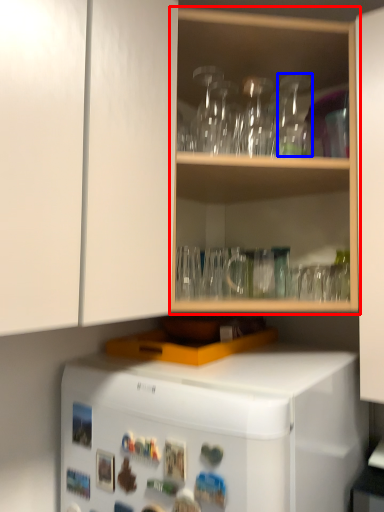
Question: Which object appears closest to the camera in this image, shelf (highlighted by a red box) or glass vase (highlighted by a blue box)?

Choices:
 (A) shelf
 (B) glass vase

Answer: (A)